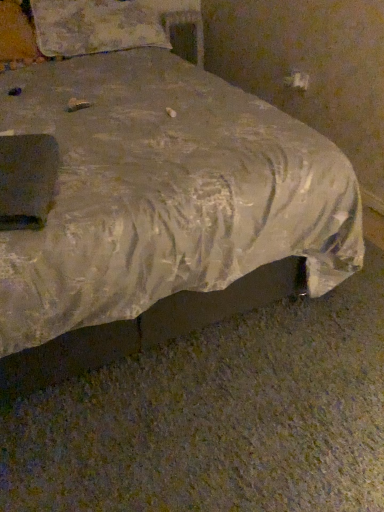
Question: From a real-world perspective, is white fabric pillow at upper left above or below silvery fabric bed at center?

Choices:
 (A) below
 (B) above

Answer: (B)

Question: Based on their sizes in the image, would you say white fabric pillow at upper left is bigger or smaller than silvery fabric bed at center?

Choices:
 (A) small
 (B) big

Answer: (A)

Question: Considering the positions of point (71, 13) and point (167, 150), is point (71, 13) closer or farther from the camera than point (167, 150)?

Choices:
 (A) closer
 (B) farther

Answer: (B)

Question: Relative to white fabric pillow at upper left, is silvery fabric bed at center in front or behind?

Choices:
 (A) front
 (B) behind

Answer: (A)

Question: Considering the positions of point (64, 360) and point (89, 25), is point (64, 360) closer or farther from the camera than point (89, 25)?

Choices:
 (A) closer
 (B) farther

Answer: (A)

Question: From the image's perspective, is silvery fabric bed at center positioned above or below white fabric pillow at upper left?

Choices:
 (A) above
 (B) below

Answer: (B)

Question: From a real-world perspective, is silvery fabric bed at center positioned above or below white fabric pillow at upper left?

Choices:
 (A) above
 (B) below

Answer: (B)